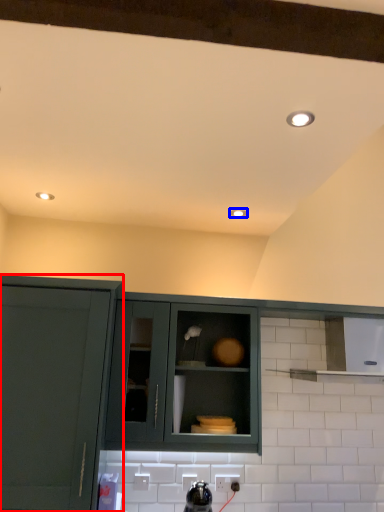
Question: Which object appears closest to the camera in this image, cabinetry (highlighted by a red box) or lighting (highlighted by a blue box)?

Choices:
 (A) cabinetry
 (B) lighting

Answer: (A)